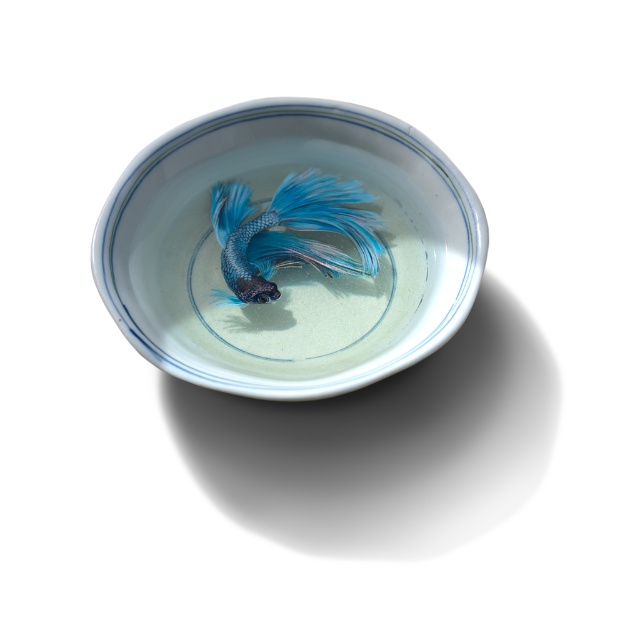
You are standing in front of a decorative bowl and a fish. The porcelain bowl at center and the blue glossy fish at center are both in your view. Which object is positioned to the right side?

The blue glossy fish at center is positioned to the right of the porcelain bowl at center.

You are positioning a decorative item on a shelf and need to ensure it aligns with the porcelain bowl at center. If the shelf has a coordinate grid where the center is at point 0.5, what direction should you move the new item to align it with the bowl?

The porcelain bowl at center is located at point (291, 268), so you should move the new item slightly to the right and down to align it with the bowl.